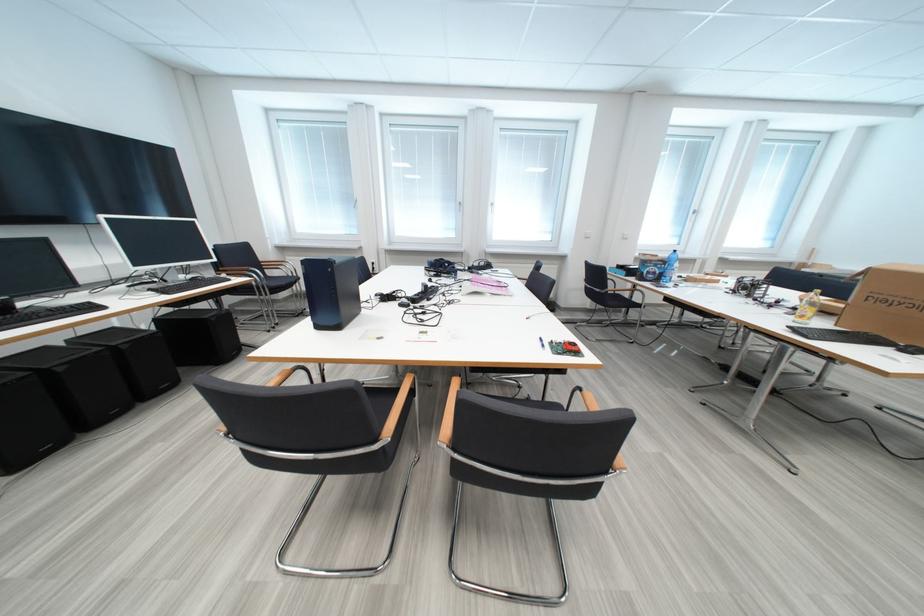
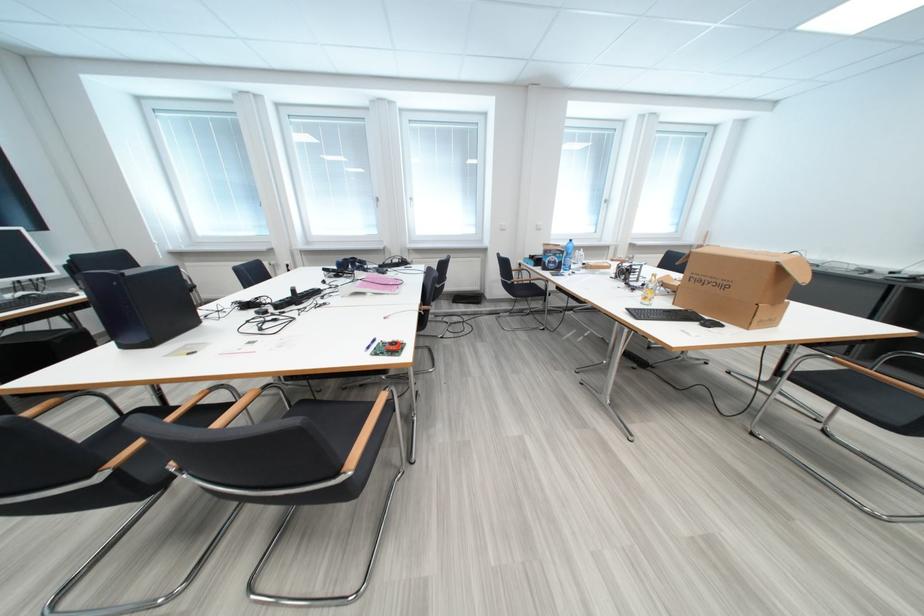
Where in the second image is the point corresponding to (x=665, y=268) from the first image?

(565, 257)